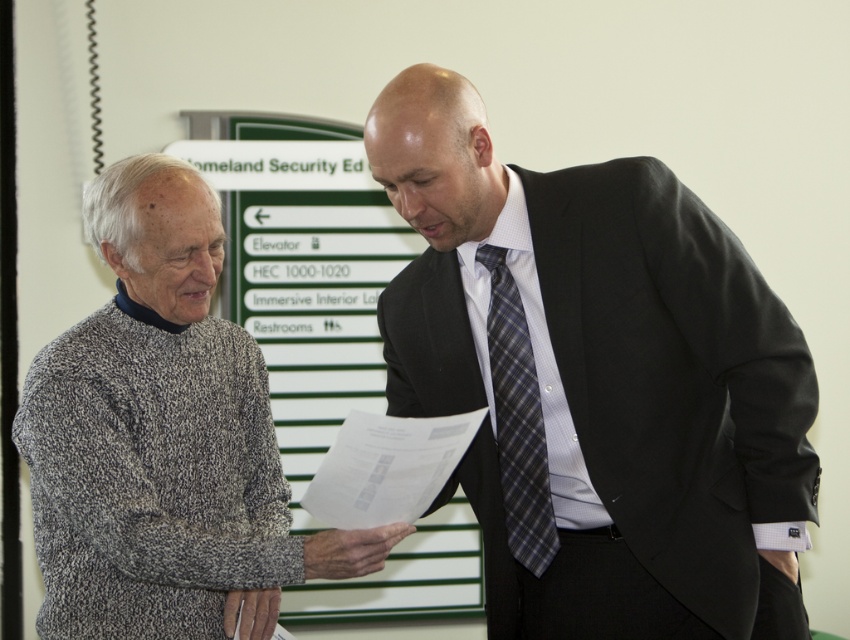
Question: Which of the following is the farthest from the observer?

Choices:
 (A) white paper at center
 (B) plaid fabric tie at center
 (C) matte black suit at center

Answer: (B)

Question: Does speckled wool sweater at left have a greater width compared to plaid fabric tie at center?

Choices:
 (A) no
 (B) yes

Answer: (B)

Question: Which object appears farthest from the camera in this image?

Choices:
 (A) speckled wool sweater at left
 (B) matte black suit at center

Answer: (A)

Question: Which point is farther to the camera?

Choices:
 (A) (110, 628)
 (B) (497, 352)

Answer: (B)

Question: Does matte black suit at center come behind plaid fabric tie at center?

Choices:
 (A) no
 (B) yes

Answer: (A)

Question: Considering the relative positions of white paper at center and plaid fabric tie at center in the image provided, where is white paper at center located with respect to plaid fabric tie at center?

Choices:
 (A) left
 (B) right

Answer: (A)